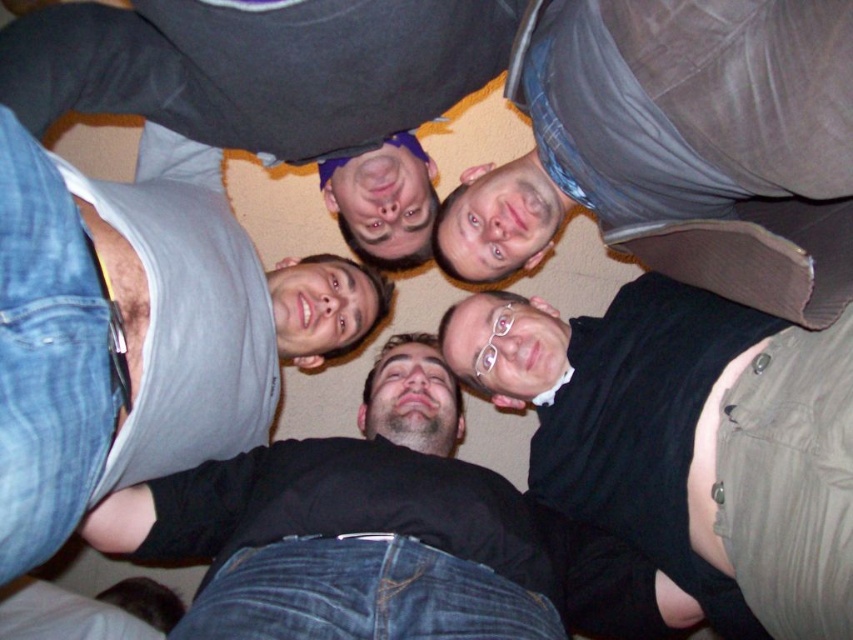
You are a photographer taking a picture from above of two people lying in a circle. You notice the black matte shirt at lower right and the gray matte tank top at upper center. Which clothing item is taller in the photo?

The black matte shirt at lower right is taller than the gray matte tank top at upper center according to the description.

You are a photographer taking a picture of the group of people lying in a circle. You notice the black matte shirt at lower right and the gray fabric tank top at upper left. Which one is closer to the camera?

The black matte shirt at lower right is closer to the camera because the gray fabric tank top at upper left is behind it.